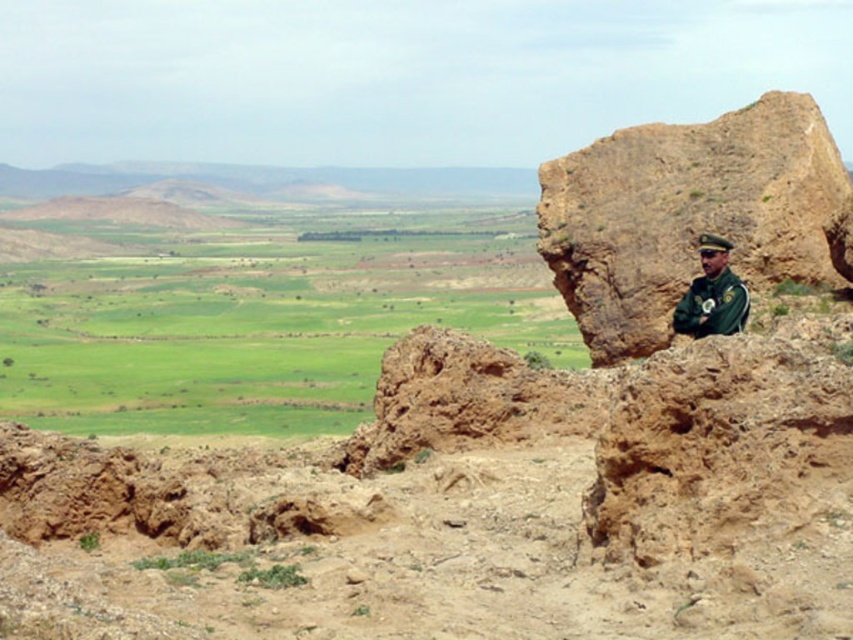
Looking at this image, you are a hiker who wants to cross the rugged landscape. You see the green grassland at center and the brown rough rock at right. Which path would be easier to walk on?

The green grassland at center is to the left of brown rough rock at right, so the green grassland at center would be easier to walk on since grasslands are typically flatter and less obstructed than rocky terrain.

You are a hiker who wants to set up a tent. You have two options for the location. The first is the green grassland at center, and the second is the green uniform at right. Which location has more space for your tent?

The green grassland at center has a larger size compared to the green uniform at right, so it has more space for your tent.

You are standing in the arid landscape and want to walk from the point at coordinates point (740, 148) to the point at coordinates point (721, 314). Which direction should you face to move towards the second point?

You should face towards the direction away from the camera because point (740, 148) is further to the camera than point (721, 314), so moving towards the second point requires moving away from the camera.